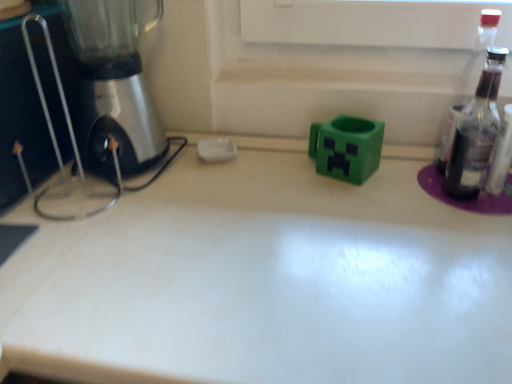
Find the location of `free space on the front side of transparent glass bottle at right`. free space on the front side of transparent glass bottle at right is located at coordinates (446, 255).